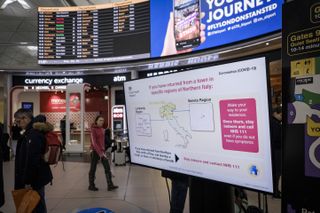
Image resolution: width=320 pixels, height=213 pixels. What are the coordinates of `tv` in the screenshot? It's located at (235, 79).